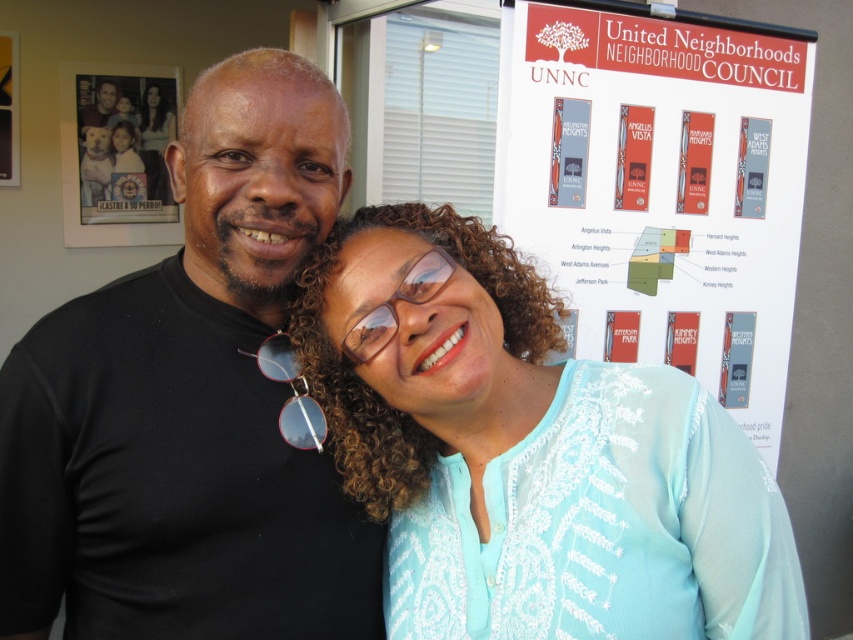
Does matte red sign at upper center have a greater height compared to matte black poster at upper left?

In fact, matte red sign at upper center may be shorter than matte black poster at upper left.

Between matte red sign at upper center and matte black poster at upper left, which one appears on the left side from the viewer's perspective?

matte black poster at upper left

Locate an element on the screen. This screenshot has height=640, width=853. matte red sign at upper center is located at coordinates (567, 152).

Where is `matte red sign at upper center`? The height and width of the screenshot is (640, 853). matte red sign at upper center is located at coordinates pyautogui.click(x=567, y=152).

Is red paper poster at upper right to the left of matte black photo at upper left from the viewer's perspective?

No, red paper poster at upper right is not to the left of matte black photo at upper left.

Between point (602, 340) and point (157, 104), which one is positioned in front?

Positioned in front is point (602, 340).

At what (x,y) coordinates should I click in order to perform the action: click on red paper poster at upper right. Please return your answer as a coordinate pair (x, y). This screenshot has width=853, height=640. Looking at the image, I should click on (663, 192).

Which is more to the right, transparent plastic glasses at center or translucent plastic sunglasses at center?

transparent plastic glasses at center is more to the right.

Is transparent plastic glasses at center above translucent plastic sunglasses at center?

Yes, transparent plastic glasses at center is above translucent plastic sunglasses at center.

Does point (386, 312) come farther from viewer compared to point (265, 356)?

No, it is in front of (265, 356).

This screenshot has width=853, height=640. I want to click on transparent plastic glasses at center, so click(393, 304).